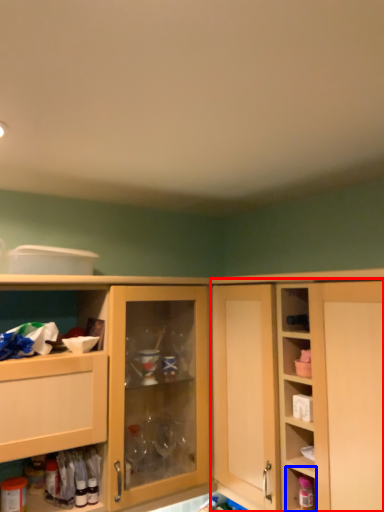
Question: Which object appears closest to the camera in this image, cabinetry (highlighted by a red box) or cabinet (highlighted by a blue box)?

Choices:
 (A) cabinetry
 (B) cabinet

Answer: (A)